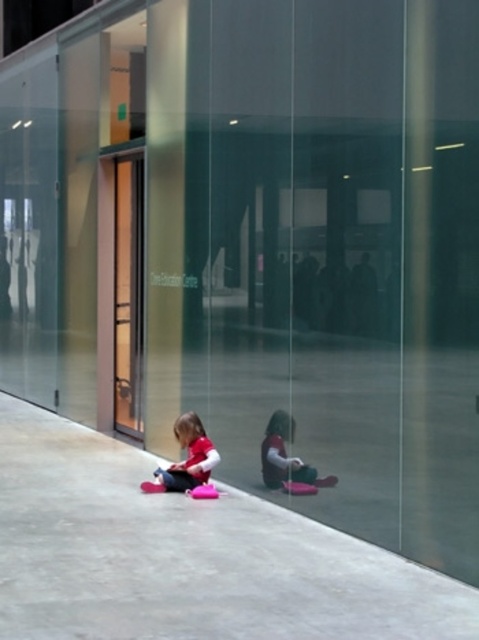
You are a parent trying to decide where to place a small potted plant. You have two options on the concrete at lower center and matte pink fabric at lower center. Which surface can accommodate the plant without it being too crowded?

The concrete at lower center is wider than the matte pink fabric at lower center, so placing the plant on the concrete at lower center would provide more space and reduce crowding.